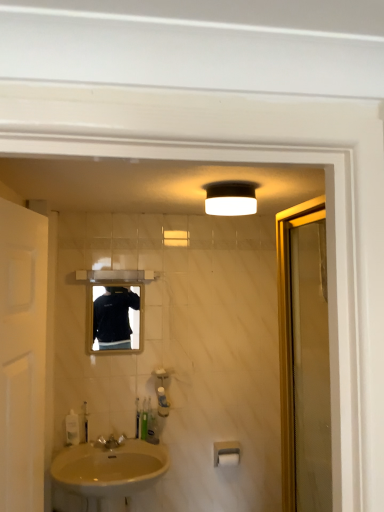
What are the coordinates of `free point in front of clear plastic bottle at lower left, the 1th toiletry when ordered from left to right` in the screenshot? It's located at [x=64, y=449].